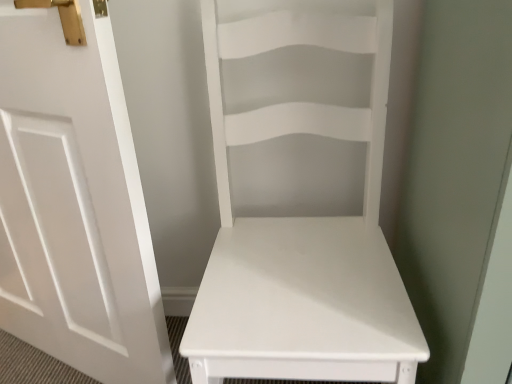
Question: From the image's perspective, would you say white matte chair at center is shown under white matte door at left?

Choices:
 (A) yes
 (B) no

Answer: (A)

Question: Could you tell me if white matte chair at center is facing white matte door at left?

Choices:
 (A) yes
 (B) no

Answer: (B)

Question: Does white matte chair at center have a larger size compared to white matte door at left?

Choices:
 (A) yes
 (B) no

Answer: (A)

Question: Is white matte chair at center to the right of white matte door at left from the viewer's perspective?

Choices:
 (A) no
 (B) yes

Answer: (B)

Question: From the image's perspective, is white matte chair at center on top of white matte door at left?

Choices:
 (A) yes
 (B) no

Answer: (B)

Question: Can we say white matte chair at center lies outside white matte door at left?

Choices:
 (A) no
 (B) yes

Answer: (B)

Question: Is white matte door at left further to the viewer compared to white matte chair at center?

Choices:
 (A) yes
 (B) no

Answer: (A)

Question: Is white matte door at left beside white matte chair at center?

Choices:
 (A) yes
 (B) no

Answer: (B)

Question: Is white matte door at left closer to the viewer compared to white matte chair at center?

Choices:
 (A) yes
 (B) no

Answer: (B)

Question: Does white matte door at left have a smaller size compared to white matte chair at center?

Choices:
 (A) yes
 (B) no

Answer: (A)

Question: Considering the relative positions of white matte door at left and white matte chair at center in the image provided, is white matte door at left to the right of white matte chair at center from the viewer's perspective?

Choices:
 (A) yes
 (B) no

Answer: (B)

Question: From the image's perspective, is white matte door at left located beneath white matte chair at center?

Choices:
 (A) yes
 (B) no

Answer: (B)

Question: Is point (9, 322) positioned closer to the camera than point (232, 271)?

Choices:
 (A) closer
 (B) farther

Answer: (B)